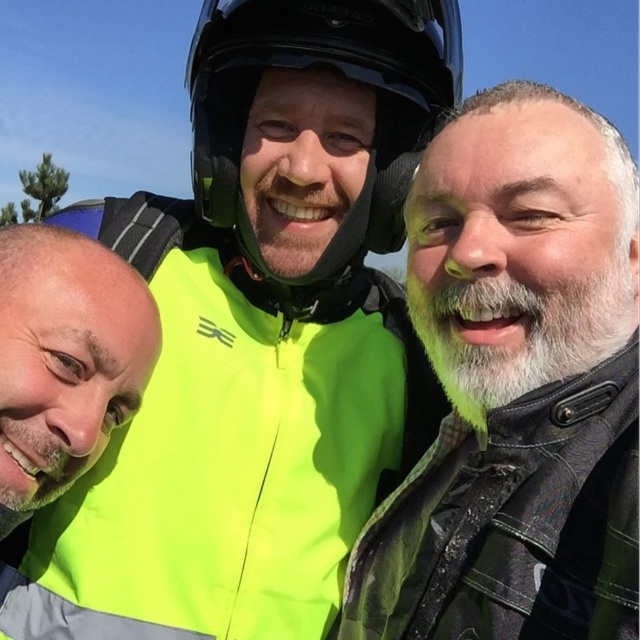
Which is in front, point (531, 371) or point (1, 492)?

Point (531, 371) is more forward.

This screenshot has height=640, width=640. What are the coordinates of `matte black helmet at upper center` in the screenshot? It's located at (516, 387).

Between point (349, 609) and point (28, 428), which one is positioned behind?

The point (349, 609) is behind.

This screenshot has height=640, width=640. Identify the location of matte black helmet at upper center. (516, 387).

Between neon yellow jacket at center and matte black helmet at upper center, which one appears on the right side from the viewer's perspective?

matte black helmet at upper center is more to the right.

Can you confirm if neon yellow jacket at center is shorter than matte black helmet at upper center?

No, neon yellow jacket at center is not shorter than matte black helmet at upper center.

Which is in front, point (234, 584) or point (433, 369)?

Positioned in front is point (234, 584).

The image size is (640, 640). What are the coordinates of `neon yellow jacket at center` in the screenshot? It's located at (259, 337).

Describe the element at coordinates (516, 387) in the screenshot. I see `matte black helmet at upper center` at that location.

Can you confirm if matte black helmet at upper center is positioned to the left of glossy black helmet at center?

No, matte black helmet at upper center is not to the left of glossy black helmet at center.

Describe the element at coordinates (516, 387) in the screenshot. I see `matte black helmet at upper center` at that location.

Locate an element on the screen. This screenshot has height=640, width=640. matte black helmet at upper center is located at coordinates (516, 387).